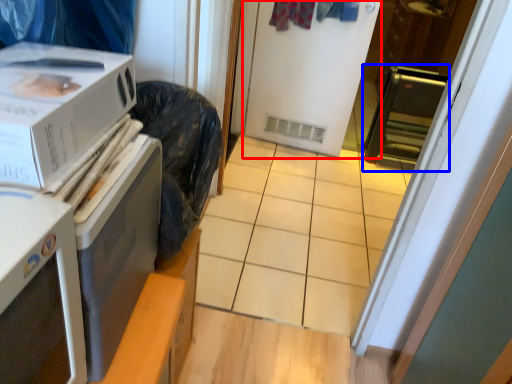
Question: Which of the following is the farthest to the observer, screen door (highlighted by a red box) or appliance (highlighted by a blue box)?

Choices:
 (A) screen door
 (B) appliance

Answer: (B)